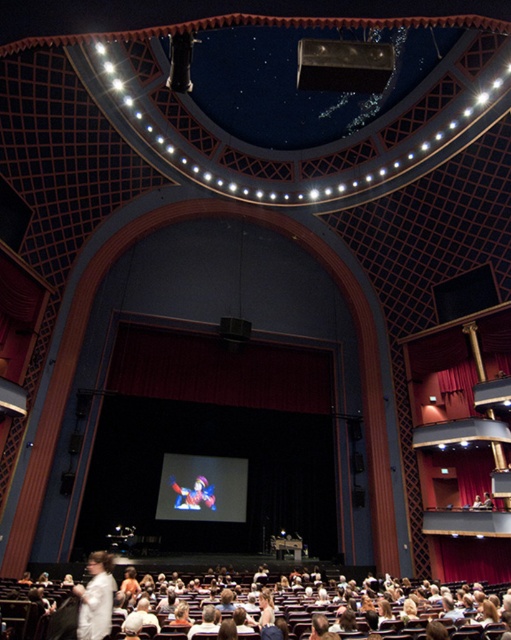
You are standing in the theater and notice a white fabric coat at lower center. If you want to reach it without moving your position, can you do so with your arms stretched out fully? Assume your arm span is 6 feet.

The distance between you and the white fabric coat at lower center is 15.74 feet, which is greater than your arm span of 6 feet. Therefore, you cannot reach it without moving closer.

Consider the image. You are a photographer positioned at the camera. You need to capture a clear photo of the white matte shirt at lower left. The theater has a rule that you must stay at least 4 meters away from any audience member. Is your current position compliant with the theater rules?

The white matte shirt at lower left is 4.49 meters away from camera. Since 4.49 meters is more than the required 4 meters, your current position is compliant with the theater rules.

You are a stagehand in the theater and need to place a 1.2 meter tall prop on the stage. You see the white fabric coat at lower center and the multicolored plush toy at center. Which object can the prop be placed next to without blocking the view of the smaller one?

The prop should be placed next to the multicolored plush toy at center because the white fabric coat at lower center is taller than the multicolored plush toy at center, so placing the prop next to the shorter plush toy would avoid blocking its view.